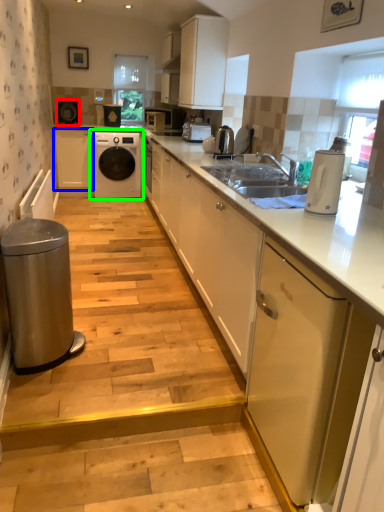
Question: Which is farther away from appliance (highlighted by a red box)? cabinetry (highlighted by a blue box) or washing machine (highlighted by a green box)?

Choices:
 (A) cabinetry
 (B) washing machine

Answer: (B)